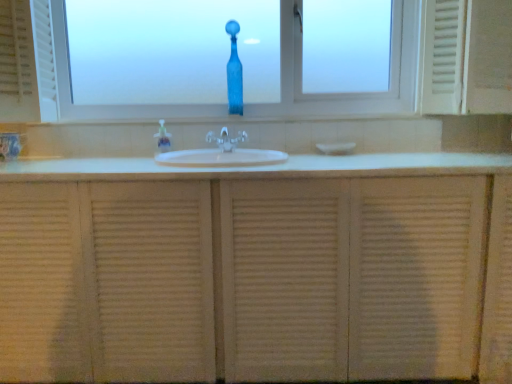
Question: Is white textured cabinet at center bigger than translucent plastic soap dispenser at center?

Choices:
 (A) no
 (B) yes

Answer: (B)

Question: Does white textured cabinet at center have a lesser height compared to translucent plastic soap dispenser at center?

Choices:
 (A) no
 (B) yes

Answer: (A)

Question: Is white textured cabinet at center looking in the opposite direction of translucent plastic soap dispenser at center?

Choices:
 (A) no
 (B) yes

Answer: (A)

Question: Is white textured cabinet at center aimed at translucent plastic soap dispenser at center?

Choices:
 (A) yes
 (B) no

Answer: (B)

Question: From a real-world perspective, is white textured cabinet at center below translucent plastic soap dispenser at center?

Choices:
 (A) no
 (B) yes

Answer: (B)

Question: From the image's perspective, relative to white ceramic sink at center, is transparent glass window at center above or below?

Choices:
 (A) below
 (B) above

Answer: (B)

Question: Looking at their shapes, would you say transparent glass window at center is wider or thinner than white ceramic sink at center?

Choices:
 (A) wide
 (B) thin

Answer: (B)

Question: Considering their positions, is transparent glass window at center located in front of or behind white ceramic sink at center?

Choices:
 (A) behind
 (B) front

Answer: (A)

Question: In terms of height, does transparent glass window at center look taller or shorter compared to white ceramic sink at center?

Choices:
 (A) tall
 (B) short

Answer: (A)

Question: Considering the positions of clear plastic faucet at center and blue glass vase at center in the image, is clear plastic faucet at center taller or shorter than blue glass vase at center?

Choices:
 (A) tall
 (B) short

Answer: (B)

Question: In terms of width, does clear plastic faucet at center look wider or thinner when compared to blue glass vase at center?

Choices:
 (A) thin
 (B) wide

Answer: (B)

Question: Considering the positions of clear plastic faucet at center and blue glass vase at center in the image, is clear plastic faucet at center bigger or smaller than blue glass vase at center?

Choices:
 (A) small
 (B) big

Answer: (A)

Question: From the image's perspective, relative to blue glass vase at center, is clear plastic faucet at center above or below?

Choices:
 (A) below
 (B) above

Answer: (A)

Question: From their relative heights in the image, would you say white textured cabinet at center is taller or shorter than translucent plastic soap dispenser at center?

Choices:
 (A) short
 (B) tall

Answer: (B)

Question: From the image's perspective, is white textured cabinet at center positioned above or below translucent plastic soap dispenser at center?

Choices:
 (A) above
 (B) below

Answer: (B)